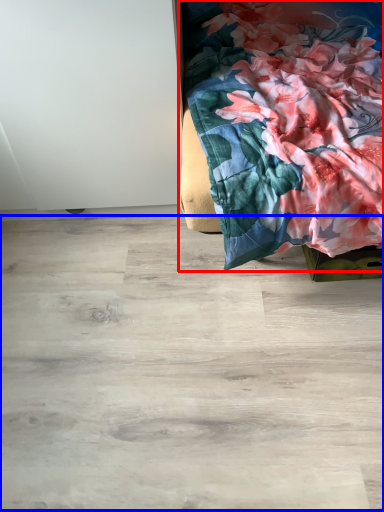
Question: Among these objects, which one is farthest to the camera, furniture (highlighted by a red box) or plywood (highlighted by a blue box)?

Choices:
 (A) furniture
 (B) plywood

Answer: (B)